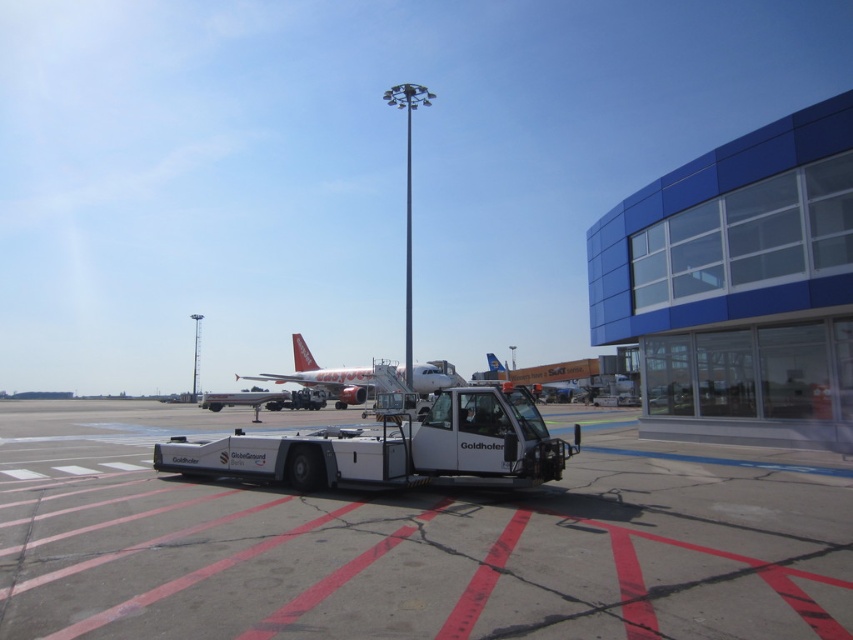
Question: Which of the following is the closest to the observer?

Choices:
 (A) (550, 566)
 (B) (540, 433)

Answer: (A)

Question: Which point is closer to the camera?

Choices:
 (A) white matte tow truck at center
 (B) matte red airplane at center
 (C) white rubber tarmac at center

Answer: (C)

Question: Can you confirm if white matte tow truck at center is wider than matte red airplane at center?

Choices:
 (A) no
 (B) yes

Answer: (A)

Question: Which point is closer to the camera?

Choices:
 (A) matte red airplane at center
 (B) white matte tow truck at center
 (C) white rubber tarmac at center

Answer: (C)

Question: Is white rubber tarmac at center to the left of white matte tow truck at center from the viewer's perspective?

Choices:
 (A) no
 (B) yes

Answer: (B)

Question: Is white rubber tarmac at center smaller than white matte tow truck at center?

Choices:
 (A) yes
 (B) no

Answer: (B)